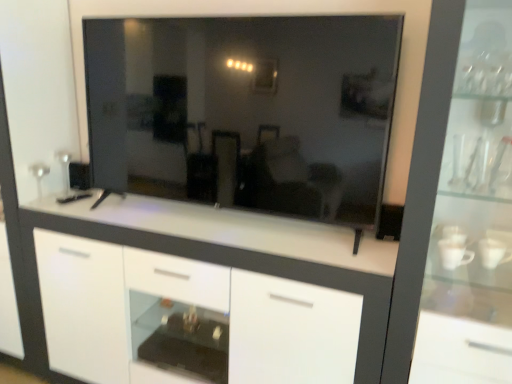
Question: From their relative heights in the image, would you say white glossy cabinet at center is taller or shorter than transparent glass mirror at center?

Choices:
 (A) short
 (B) tall

Answer: (B)

Question: From a real-world perspective, is white glossy cabinet at center above or below transparent glass mirror at center?

Choices:
 (A) above
 (B) below

Answer: (B)

Question: Estimate the real-world distances between objects in this image. Which object is farther from the transparent glass mirror at center?

Choices:
 (A) transparent glass cabinet at right
 (B) white glossy cabinet at center

Answer: (A)

Question: Which of these objects is positioned closest to the white glossy cabinet at center?

Choices:
 (A) transparent glass cabinet at right
 (B) transparent glass mirror at center

Answer: (B)